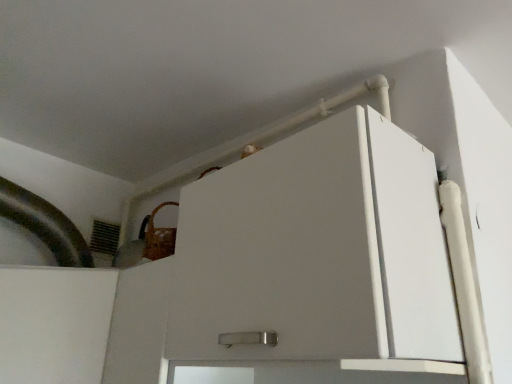
At what (x,y) coordinates should I click in order to perform the action: click on white matte cabinet at lower left. Please return your answer as a coordinate pair (x, y). The image size is (512, 384). Looking at the image, I should click on tap(54, 323).

What is the approximate height of white matte cabinet at lower left?

It is 14.61 inches.

Describe the element at coordinates (54, 323) in the screenshot. I see `white matte cabinet at lower left` at that location.

At what (x,y) coordinates should I click in order to perform the action: click on white matte cabinet at lower left. Please return your answer as a coordinate pair (x, y). The height and width of the screenshot is (384, 512). Looking at the image, I should click on (54, 323).